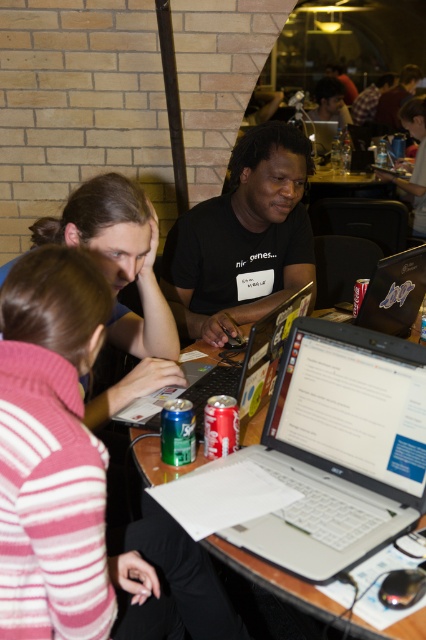
Between wooden table at center and silver metallic laptop at center, which one has less height?

Standing shorter between the two is wooden table at center.

Can you confirm if wooden table at center is thinner than silver metallic laptop at center?

Incorrect, wooden table at center's width is not less than silver metallic laptop at center's.

Does point (412, 627) come in front of point (255, 368)?

Yes.

The image size is (426, 640). Find the location of `wooden table at center`. wooden table at center is located at coordinates (276, 580).

Is black matte shirt at center closer to the viewer compared to silver metallic laptop at center?

No, it is not.

Can you confirm if black matte shirt at center is positioned below silver metallic laptop at center?

No, black matte shirt at center is not below silver metallic laptop at center.

Does point (166, 241) come farther from viewer compared to point (227, 365)?

That is True.

The width and height of the screenshot is (426, 640). I want to click on black matte shirt at center, so click(x=242, y=240).

Is point (370, 625) more distant than point (408, 257)?

No, (370, 625) is in front of (408, 257).

Is wooden table at center smaller than glossy plastic laptop at center?

Incorrect, wooden table at center is not smaller in size than glossy plastic laptop at center.

Between point (414, 634) and point (405, 268), which one is positioned in front?

Point (414, 634) is more forward.

Identify the location of wooden table at center. (276, 580).